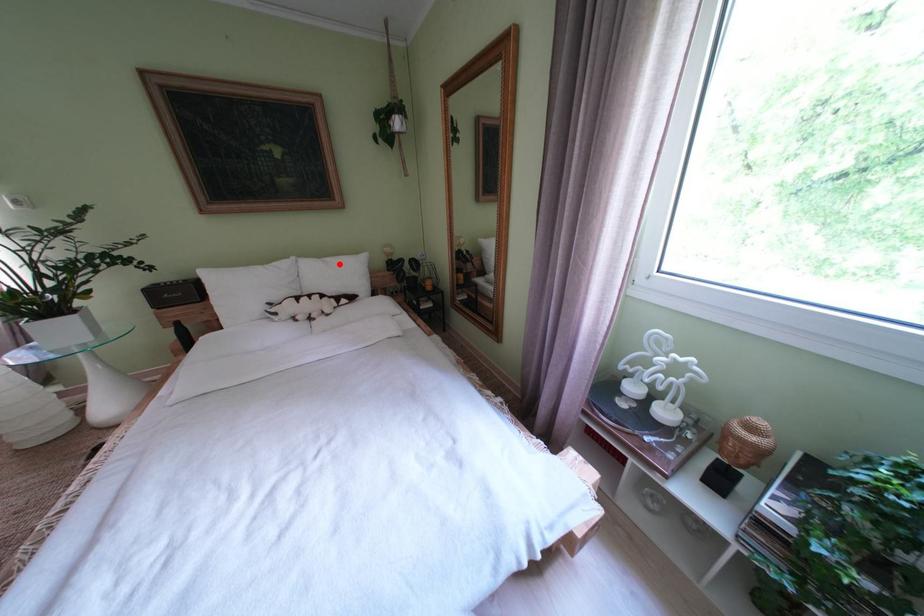
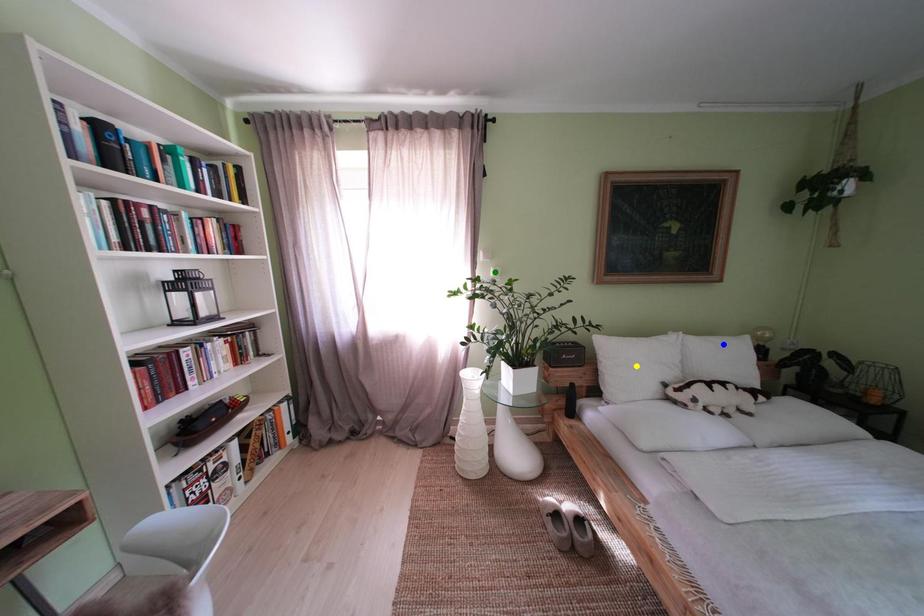
Question: I am providing you with two images of the same scene from different viewpoints. A red point is marked on the first image. You are given multiple points on the second image. Can you choose the point in image 2 that corresponds to the point in image 1?

Choices:
 (A) yellow point
 (B) green point
 (C) blue point

Answer: (C)